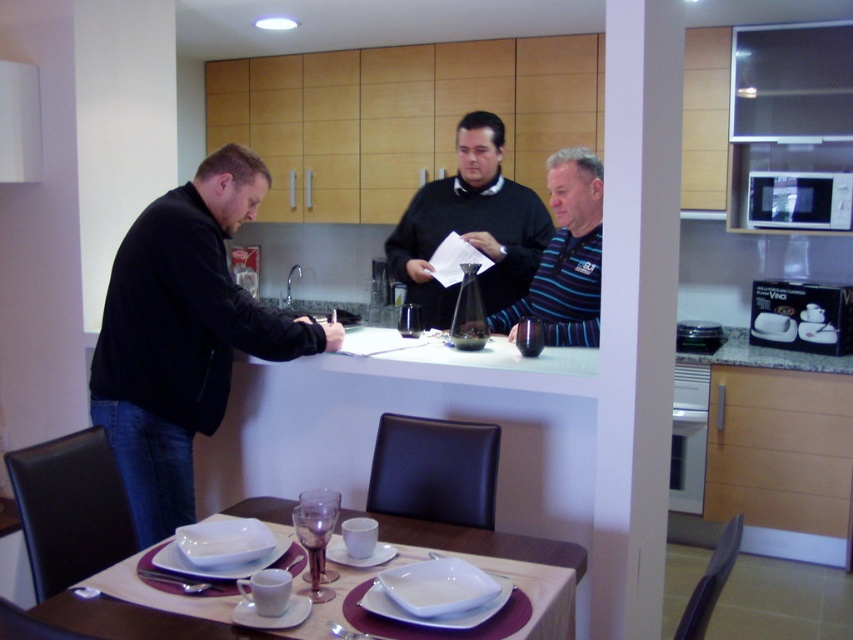
Question: Is matte black sweater at center above striped polo shirt at center?

Choices:
 (A) yes
 (B) no

Answer: (A)

Question: Which point is farther to the camera?

Choices:
 (A) white glossy table at center
 (B) matte black sweater at center
 (C) striped polo shirt at center
 (D) metallic silver microwave at upper right

Answer: (D)

Question: Which point is farther to the camera?

Choices:
 (A) clear glass wine glass at table center
 (B) metallic silver microwave at upper right

Answer: (B)

Question: Which object is the closest to the clear glass wine glass at table center?

Choices:
 (A) white glossy table at center
 (B) black matte jacket at left
 (C) matte black sweater at center

Answer: (A)

Question: Does black matte jacket at left lie behind clear glass wine glass at table center?

Choices:
 (A) no
 (B) yes

Answer: (B)

Question: Is white glossy table at center smaller than clear glass wine glass at table center?

Choices:
 (A) yes
 (B) no

Answer: (B)